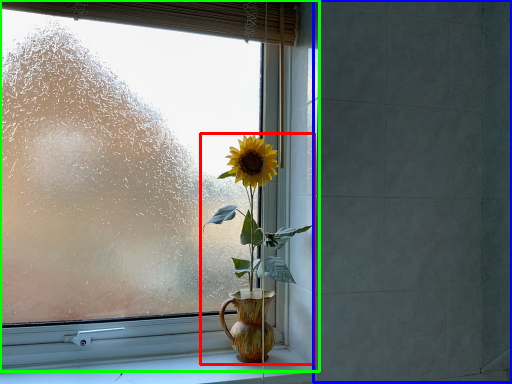
Question: Which is farther away from houseplant (highlighted by a red box)? backdrop (highlighted by a blue box) or window (highlighted by a green box)?

Choices:
 (A) backdrop
 (B) window

Answer: (A)